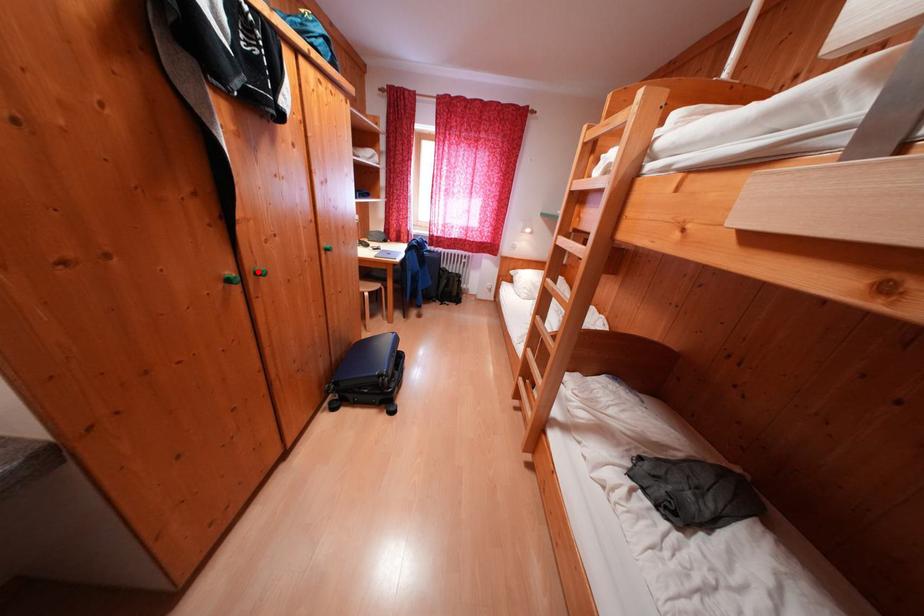
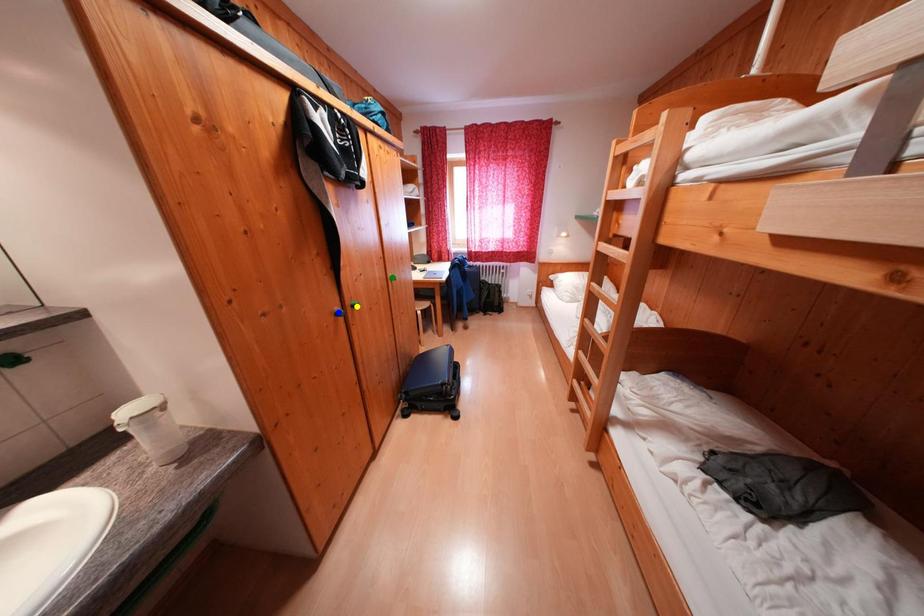
Question: I am providing you with two images of the same scene from different viewpoints. A red point is marked on the first image. You are given multiple points on the second image. Can you choose the point in image 2 that corresponds to the point in image 1?

Choices:
 (A) yellow point
 (B) blue point
 (C) green point

Answer: (A)